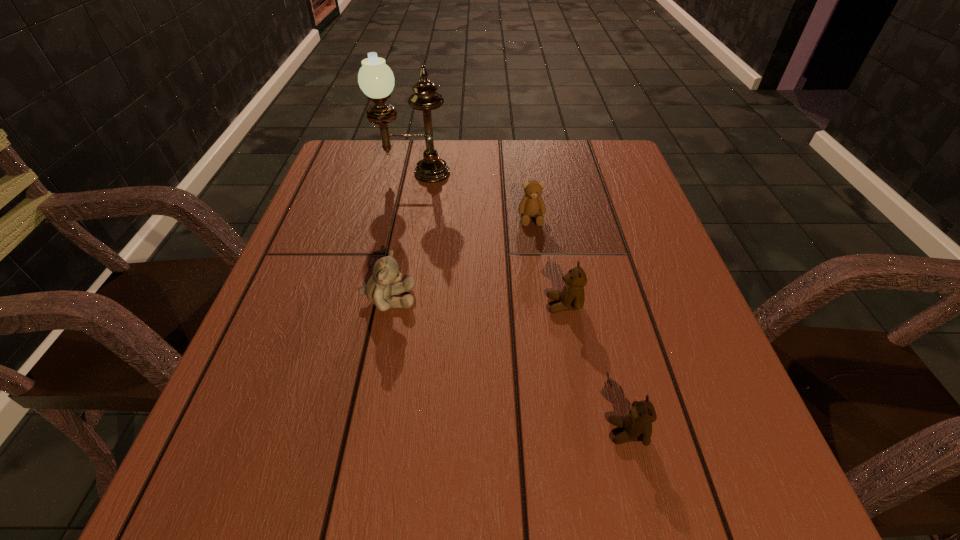
At what (x,y) coordinates should I click in order to perform the action: click on vacant space located at the face of the nearest teddy bear. Please return your answer as a coordinate pair (x, y). The image size is (960, 540). Looking at the image, I should click on (510, 432).

Locate an element on the screen. The height and width of the screenshot is (540, 960). vacant point located at the face of the nearest teddy bear is located at coordinates (510, 432).

The height and width of the screenshot is (540, 960). I want to click on object that is positioned at the far edge, so click(375, 78).

Image resolution: width=960 pixels, height=540 pixels. What are the coordinates of `object that is at the left edge` in the screenshot? It's located at (375, 78).

At what (x,y) coordinates should I click in order to perform the action: click on object positioned at the right edge. Please return your answer as a coordinate pair (x, y). This screenshot has height=540, width=960. Looking at the image, I should click on (637, 425).

At what (x,y) coordinates should I click in order to perform the action: click on object that is at the far left corner. Please return your answer as a coordinate pair (x, y). This screenshot has height=540, width=960. Looking at the image, I should click on (375, 78).

You are a GUI agent. You are given a task and a screenshot of the screen. Output one action in this format:
    pyautogui.click(x=<x>, y=<y>)
    Task: Click on the blank space at the far edge of the desktop
    
    Given the screenshot: What is the action you would take?
    pyautogui.click(x=555, y=156)

Find the location of `vacant space at the near edge of the desktop`. vacant space at the near edge of the desktop is located at coordinates (571, 519).

Locate an element on the screen. Image resolution: width=960 pixels, height=540 pixels. blank space at the left edge is located at coordinates (304, 220).

In order to click on vacant space at the right edge of the desktop in this screenshot , I will do `click(719, 414)`.